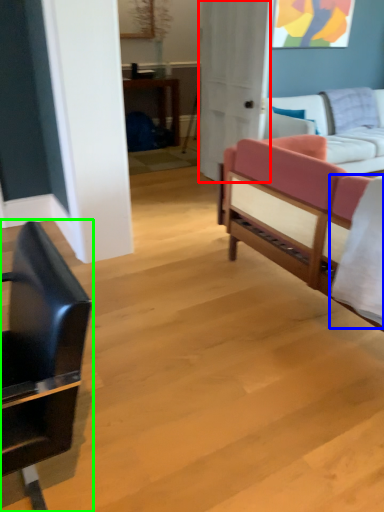
Question: Which is nearer to the glass door (highlighted by a red box)? sheet (highlighted by a blue box) or chair (highlighted by a green box).

Choices:
 (A) sheet
 (B) chair

Answer: (A)